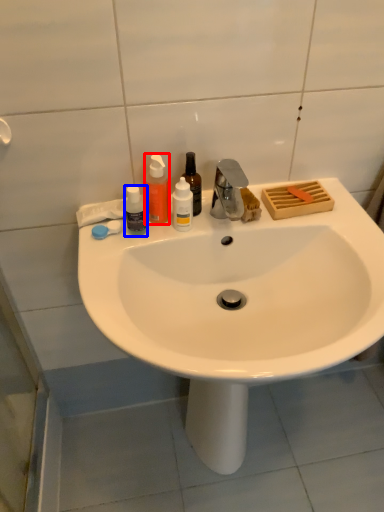
Question: Among these objects, which one is farthest to the camera, bottle (highlighted by a red box) or bottle (highlighted by a blue box)?

Choices:
 (A) bottle
 (B) bottle

Answer: (A)